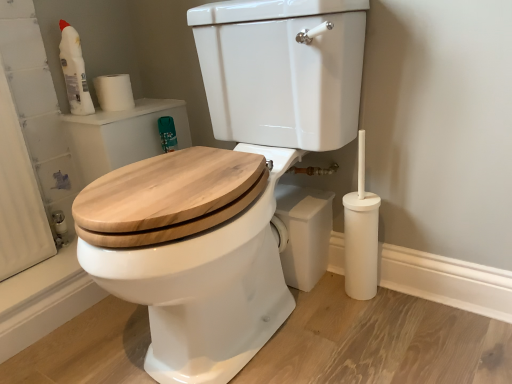
Image resolution: width=512 pixels, height=384 pixels. In order to click on free location in front of white plastic toilet brush at lower right in this screenshot , I will do `click(381, 329)`.